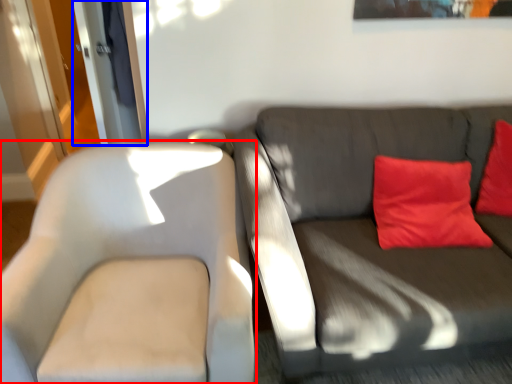
Question: Which of the following is the closest to the observer, chair (highlighted by a red box) or glass door (highlighted by a blue box)?

Choices:
 (A) chair
 (B) glass door

Answer: (A)